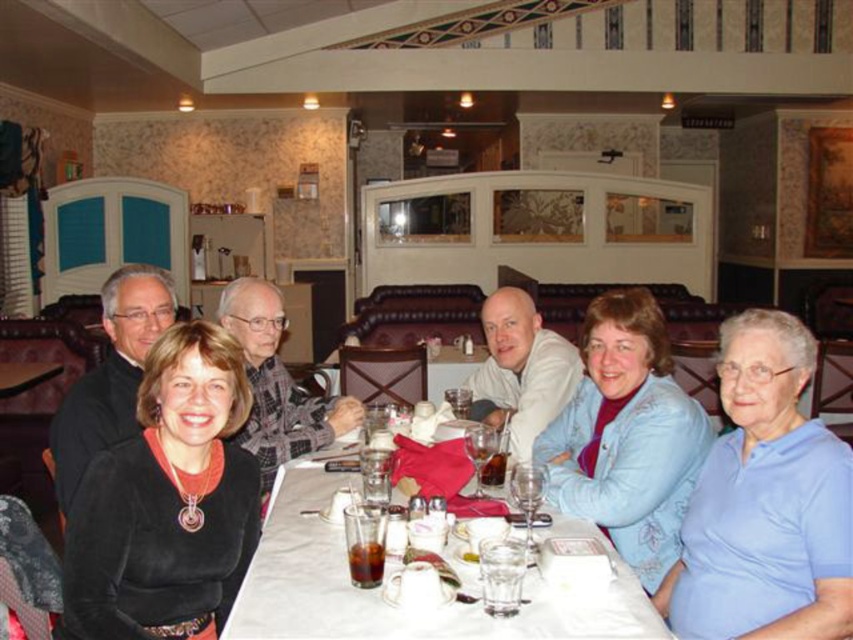
You are a photographer taking a picture of the blue satin jacket at center and the white glossy table at center. Which object is closer to the camera?

The blue satin jacket at center is located above the white glossy table at center, so it is closer to the camera.

You are a photographer taking a picture of the blue satin jacket at center and the white glossy table at center. Which object should you focus on first if you want to capture both in the same frame without moving the camera?

The blue satin jacket at center is positioned on the right side of white glossy table at center, so you should focus on the white glossy table at center first to ensure both are in frame.

You are a photographer adjusting the camera settings to ensure all subjects are in focus. The light blue cotton shirt at lower right and the blue satin jacket at center are both in the frame. Which clothing item requires less zoom adjustment to capture its details clearly?

The light blue cotton shirt at lower right requires less zoom adjustment because it is smaller in width compared to the blue satin jacket at center, so its details can be captured with a smaller zoom level.